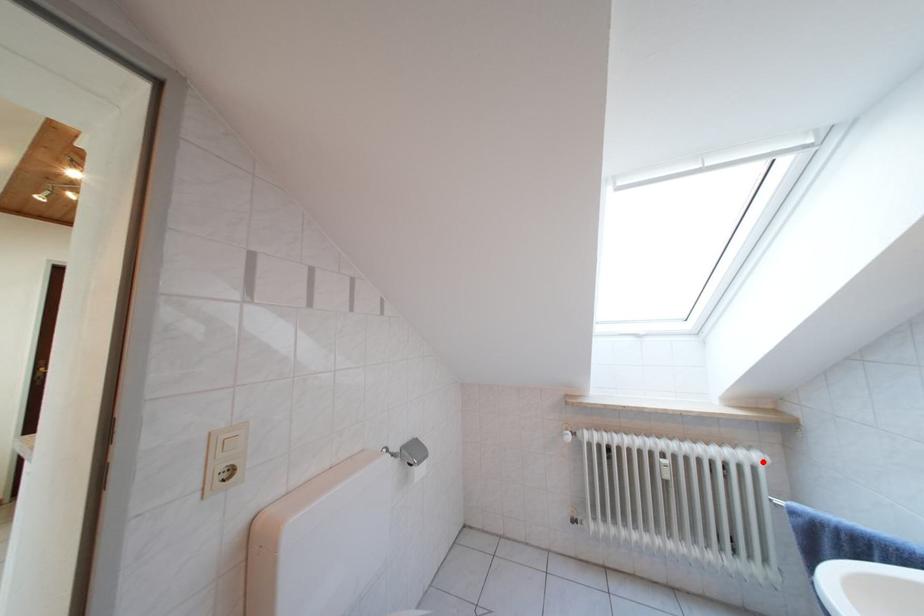
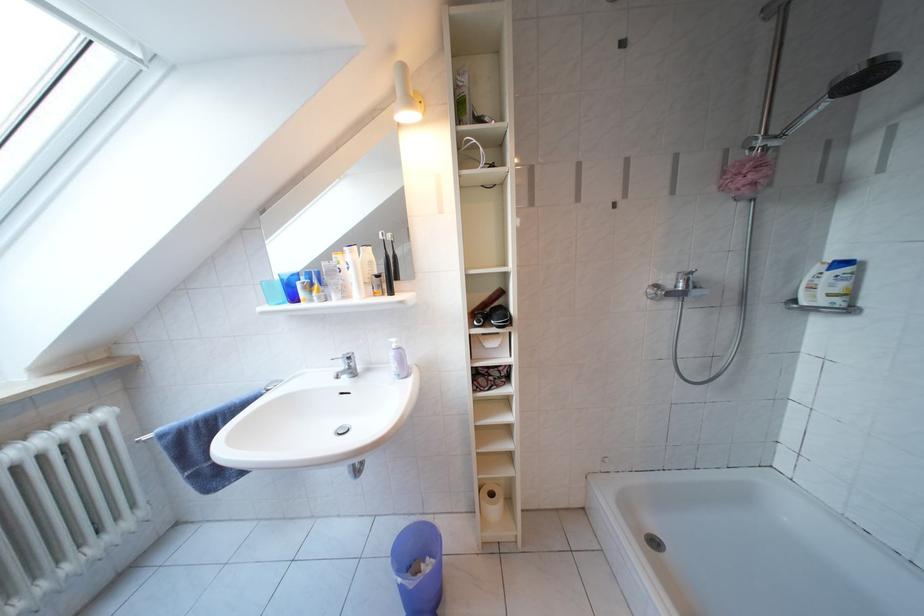
The point at the highlighted location is marked in the first image. Where is the corresponding point in the second image?

(110, 421)